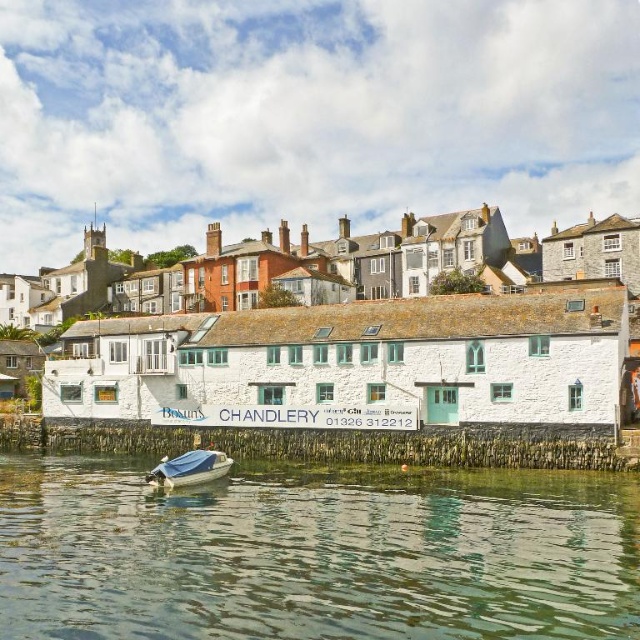
Question: Which object appears closest to the camera in this image?

Choices:
 (A) white stone building at center
 (B) greenish water at lower center

Answer: (B)

Question: Where is greenish water at lower center located in relation to white stone building at center in the image?

Choices:
 (A) below
 (B) above

Answer: (A)

Question: Does white stone building at center have a larger size compared to blue tarpaulin boat at lower center?

Choices:
 (A) yes
 (B) no

Answer: (A)

Question: Which object is closer to the camera taking this photo?

Choices:
 (A) blue tarpaulin boat at lower center
 (B) greenish water at lower center

Answer: (B)

Question: Does greenish water at lower center come in front of white stone building at center?

Choices:
 (A) no
 (B) yes

Answer: (B)

Question: Among these objects, which one is nearest to the camera?

Choices:
 (A) blue tarpaulin boat at lower center
 (B) greenish water at lower center

Answer: (B)